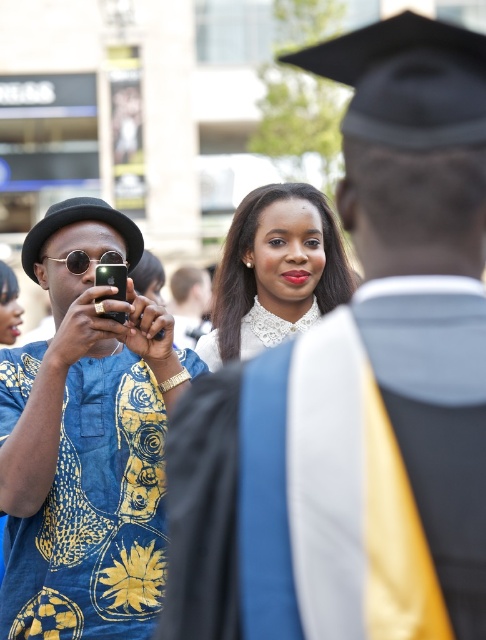
Question: Is blue patterned shirt at left further to the viewer compared to blue printed shirt at left?

Choices:
 (A) yes
 (B) no

Answer: (B)

Question: Which of these objects is positioned closest to the blue printed shirt at left?

Choices:
 (A) white lace collar at center
 (B) blue patterned shirt at left

Answer: (B)

Question: Which of the following is the farthest from the observer?

Choices:
 (A) (150, 376)
 (B) (310, 259)
 (C) (450, 461)

Answer: (B)

Question: From the image, what is the correct spatial relationship of blue patterned shirt at left in relation to white lace collar at center?

Choices:
 (A) left
 (B) right

Answer: (B)

Question: Which object appears farthest from the camera in this image?

Choices:
 (A) blue patterned shirt at left
 (B) white lace collar at center
 (C) blue printed shirt at left

Answer: (B)

Question: Does blue patterned shirt at left come behind blue printed shirt at left?

Choices:
 (A) yes
 (B) no

Answer: (B)